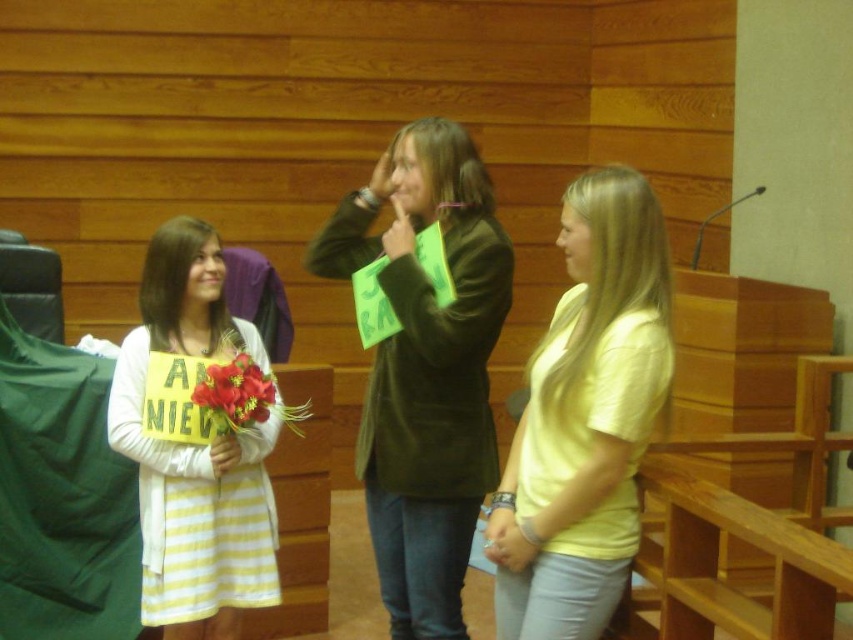
Between yellow striped dress at left and red silk flower at center, which one has more height?

With more height is yellow striped dress at left.

Can you confirm if yellow striped dress at left is shorter than red silk flower at center?

No.

Find the location of a particular element. Image resolution: width=853 pixels, height=640 pixels. yellow striped dress at left is located at coordinates (195, 451).

The height and width of the screenshot is (640, 853). In order to click on yellow striped dress at left in this screenshot , I will do `click(195, 451)`.

Does matte green sign at center lie in front of yellow striped dress at left?

Yes, it is.

Is matte green sign at center behind yellow striped dress at left?

No, matte green sign at center is closer to the viewer.

You are a GUI agent. You are given a task and a screenshot of the screen. Output one action in this format:
    pyautogui.click(x=<x>, y=<y>)
    Task: Click on the matte green sign at center
    This screenshot has height=640, width=853.
    Given the screenshot: What is the action you would take?
    pyautogui.click(x=425, y=369)

Is yellow matte shirt at center to the left of red silk flower at center from the viewer's perspective?

In fact, yellow matte shirt at center is to the right of red silk flower at center.

Between yellow matte shirt at center and red silk flower at center, which one appears on the left side from the viewer's perspective?

red silk flower at center

In order to click on yellow matte shirt at center in this screenshot , I will do click(x=585, y=419).

I want to click on yellow matte shirt at center, so click(x=585, y=419).